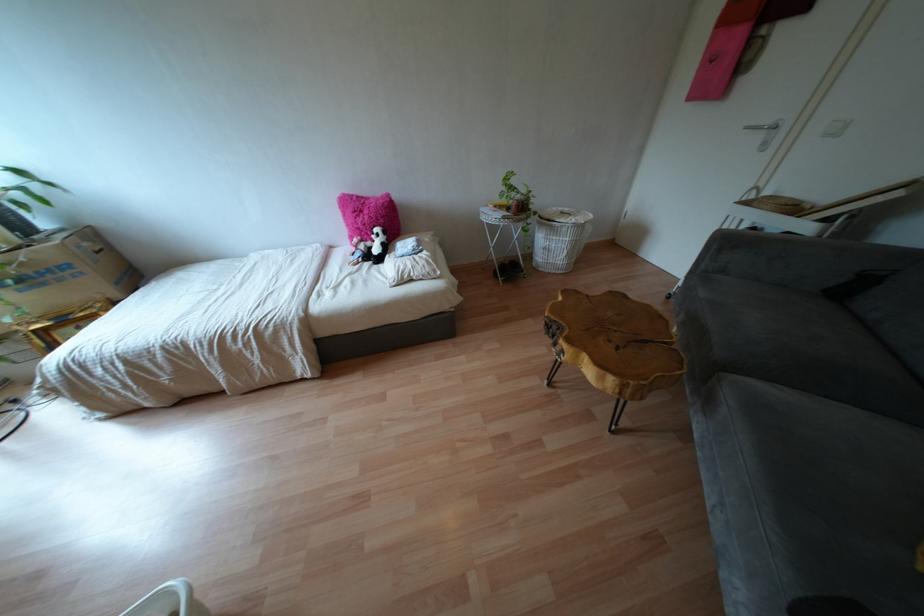
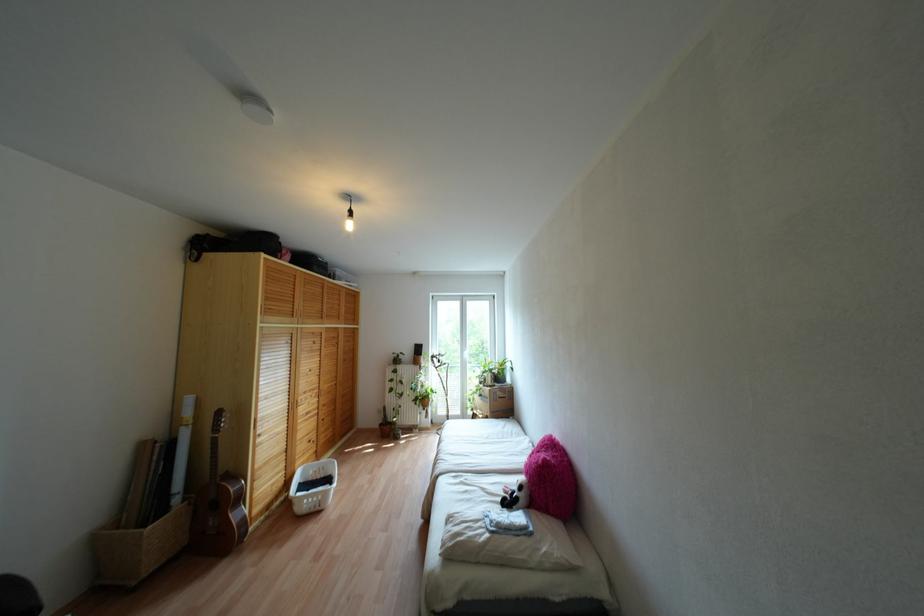
Where in the second image is the point corresponding to point 34,326 from the first image?

(473, 411)